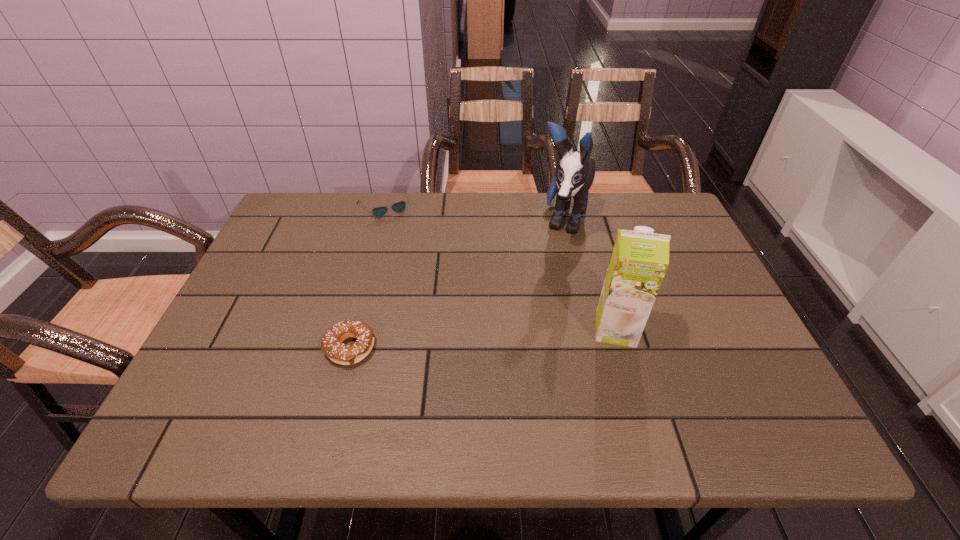
This screenshot has height=540, width=960. In order to click on vacant space at the far right corner in this screenshot , I will do `click(641, 217)`.

Find the location of a particular element. This screenshot has height=540, width=960. free space between the doughnut and the puppy is located at coordinates (456, 285).

Identify the location of free spot between the soya milk and the puppy. (589, 275).

Locate an element on the screen. vacant region between the second tallest object and the shortest object is located at coordinates (500, 268).

Locate an element on the screen. The width and height of the screenshot is (960, 540). free point between the doughnut and the soya milk is located at coordinates (483, 339).

This screenshot has height=540, width=960. Find the location of `vacant space that's between the sunglasses and the puppy`. vacant space that's between the sunglasses and the puppy is located at coordinates (473, 213).

You are a GUI agent. You are given a task and a screenshot of the screen. Output one action in this format:
    pyautogui.click(x=<x>, y=<y>)
    Task: Click on the vacant space in between the tallest object and the soya milk
    The height and width of the screenshot is (540, 960).
    Given the screenshot: What is the action you would take?
    pyautogui.click(x=589, y=275)

The image size is (960, 540). I want to click on free spot between the tallest object and the soya milk, so click(x=589, y=275).

The height and width of the screenshot is (540, 960). I want to click on free space between the doughnut and the second tallest object, so click(x=483, y=339).

Identify the location of free area in between the third shortest object and the tallest object. The width and height of the screenshot is (960, 540). (589, 275).